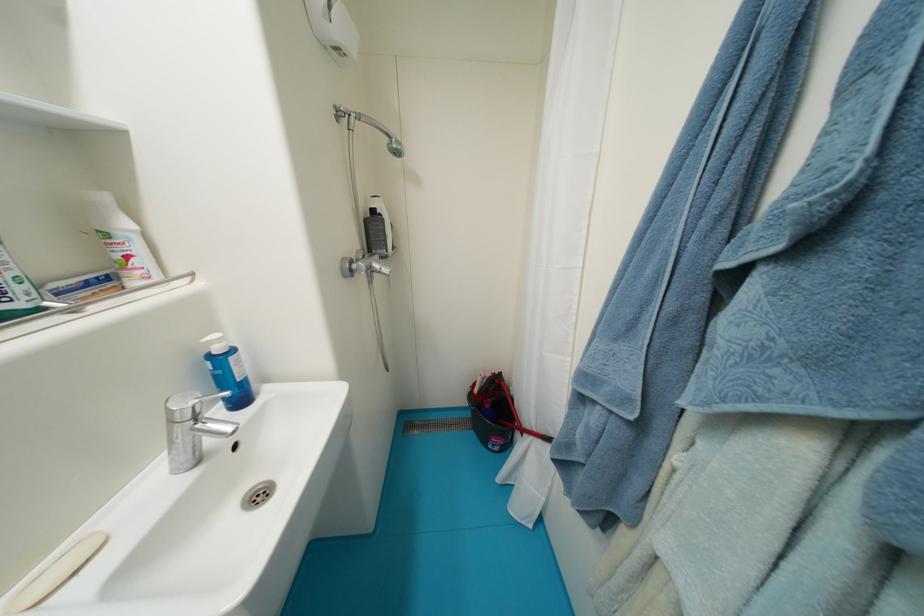
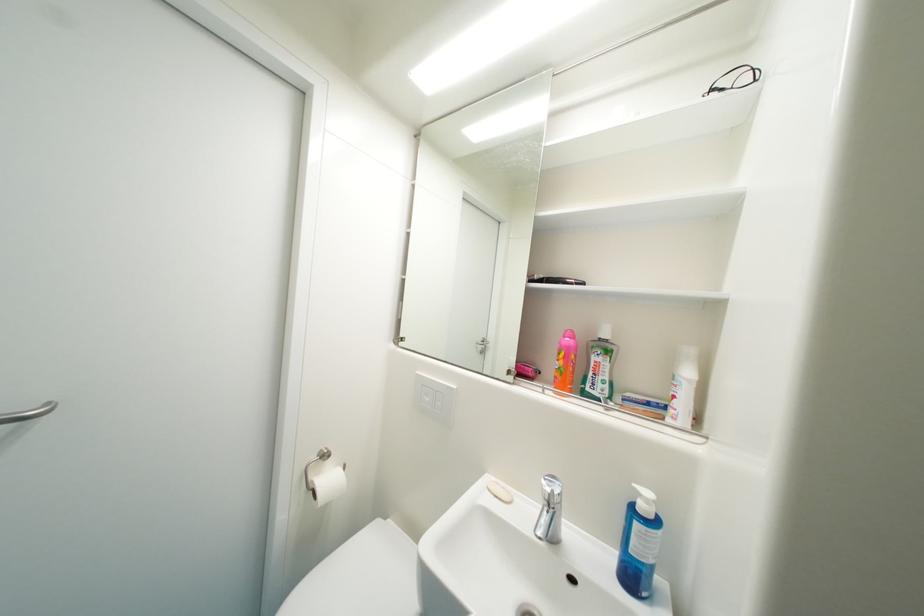
Question: I am providing you with two images of the same scene from different viewpoints. Which of the following objects are not visible in image2?

Choices:
 (A) mouthwash bottle cap
 (B) bar of soap
 (C) soap dispenser pump
 (D) none of these

Answer: (D)